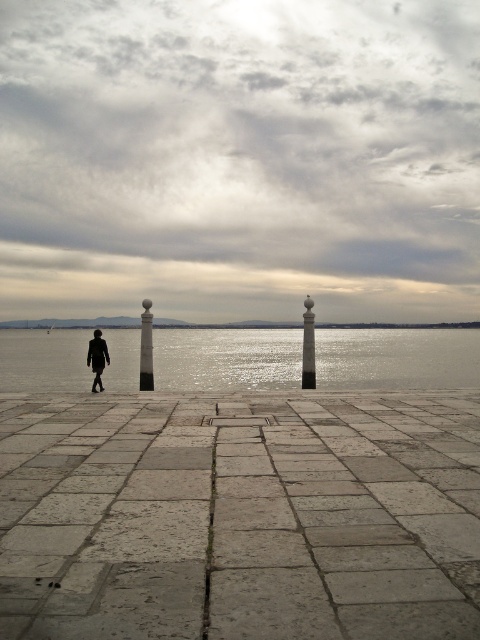
Question: Considering the relative positions of smooth black pillar at center and dark matte jacket at center in the image provided, where is smooth black pillar at center located with respect to dark matte jacket at center?

Choices:
 (A) left
 (B) right

Answer: (B)

Question: Based on their relative distances, which object is nearer to the smooth black pillar at center?

Choices:
 (A) polished stone pillar at center
 (B) dark matte jacket at center

Answer: (B)

Question: Is reflective silver water at center bigger than dark matte jacket at center?

Choices:
 (A) yes
 (B) no

Answer: (A)

Question: Can you confirm if reflective silver water at center is smaller than smooth black pillar at center?

Choices:
 (A) yes
 (B) no

Answer: (B)

Question: Which object is positioned closest to the reflective silver water at center?

Choices:
 (A) polished stone pillar at center
 (B) dark matte jacket at center
 (C) gray stone dock at center

Answer: (C)

Question: Among these objects, which one is farthest from the camera?

Choices:
 (A) smooth black pillar at center
 (B) dark matte jacket at center
 (C) polished stone pillar at center

Answer: (A)